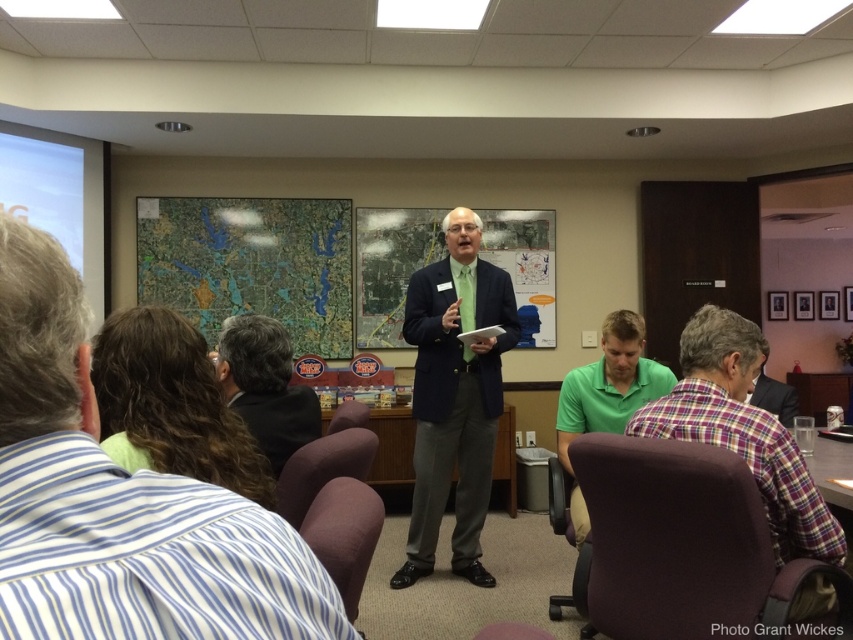
Question: Which is nearer to the plaid fabric shirt at center?

Choices:
 (A) dark brown hair at center
 (B) green matte shirt at lower center
 (C) green matte suit at center
 (D) striped shirt at left

Answer: (B)

Question: Does plaid fabric shirt at lower right come behind green matte shirt at lower center?

Choices:
 (A) no
 (B) yes

Answer: (A)

Question: Is striped shirt at left above green matte shirt at lower center?

Choices:
 (A) yes
 (B) no

Answer: (A)

Question: Is the position of plaid fabric shirt at lower right less distant than that of green matte shirt at lower center?

Choices:
 (A) yes
 (B) no

Answer: (A)

Question: Which object is positioned farthest from the plaid fabric shirt at center?

Choices:
 (A) plaid fabric shirt at lower right
 (B) green matte shirt at lower center
 (C) green matte suit at center
 (D) dark brown hair at center

Answer: (D)

Question: Which object appears closest to the camera in this image?

Choices:
 (A) green matte shirt at lower center
 (B) striped shirt at left
 (C) plaid fabric shirt at center
 (D) plaid fabric shirt at lower right

Answer: (B)